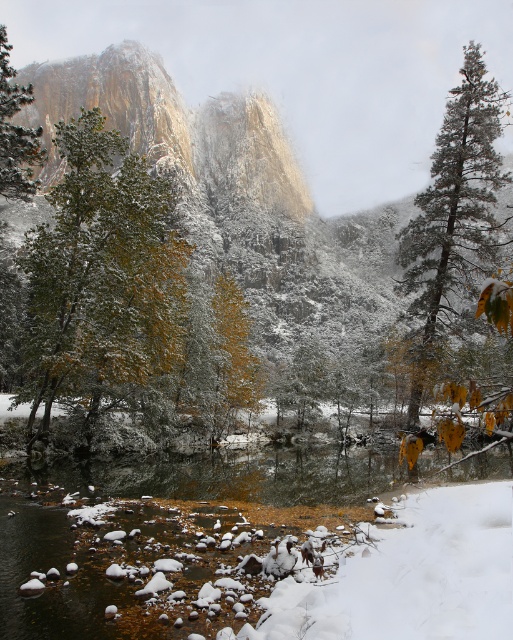
At what (x,y) coordinates should I click in order to perform the action: click on green matte tree at center. Please return your answer as a coordinate pair (x, y). Looking at the image, I should click on (127, 307).

Which is behind, point (70, 173) or point (412, 397)?

The point (412, 397) is more distant.

The image size is (513, 640). Find the location of `green matte tree at center`. green matte tree at center is located at coordinates (127, 307).

This screenshot has width=513, height=640. I want to click on green matte tree at center, so click(x=127, y=307).

Does green matte tree at center come behind green matte tree at left?

Yes, it is behind green matte tree at left.

Measure the distance between green matte tree at center and camera.

The distance of green matte tree at center from camera is 29.81 meters.

The width and height of the screenshot is (513, 640). I want to click on green matte tree at center, so click(x=127, y=307).

Between green textured pine tree at right and green matte tree at left, which one appears on the left side from the viewer's perspective?

Positioned to the left is green matte tree at left.

Who is more distant from viewer, (448, 182) or (4, 157)?

The point (448, 182) is more distant.

Locate an element on the screen. The image size is (513, 640). green textured pine tree at right is located at coordinates (453, 214).